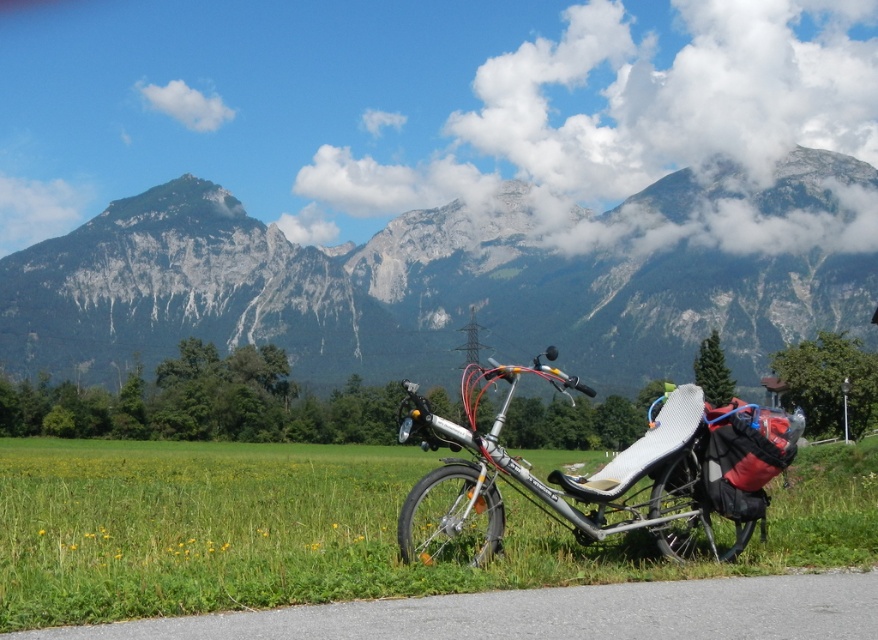
You are a hiker standing at the green grass at lower center and want to reach the rugged stone mountain at upper center. Which direction should you move to get closer to the mountain?

You should move forward towards the rugged stone mountain at upper center because it is further away from you compared to the green grass at lower center which is closer.

You are planning a mountain hike and see the rugged stone mountain at upper center and the silver metallic reclining bicycle at center. Which object is larger in size?

The rugged stone mountain at upper center is bigger than the silver metallic reclining bicycle at center.

You are standing at the edge of the green grass at lower center and want to reach the silver metallic reclining bicycle at center. Which direction should you move to get closer to the bicycle?

Since the green grass at lower center is closer to the viewer than the silver metallic reclining bicycle at center, you should move forward towards the bicycle to get closer to it.